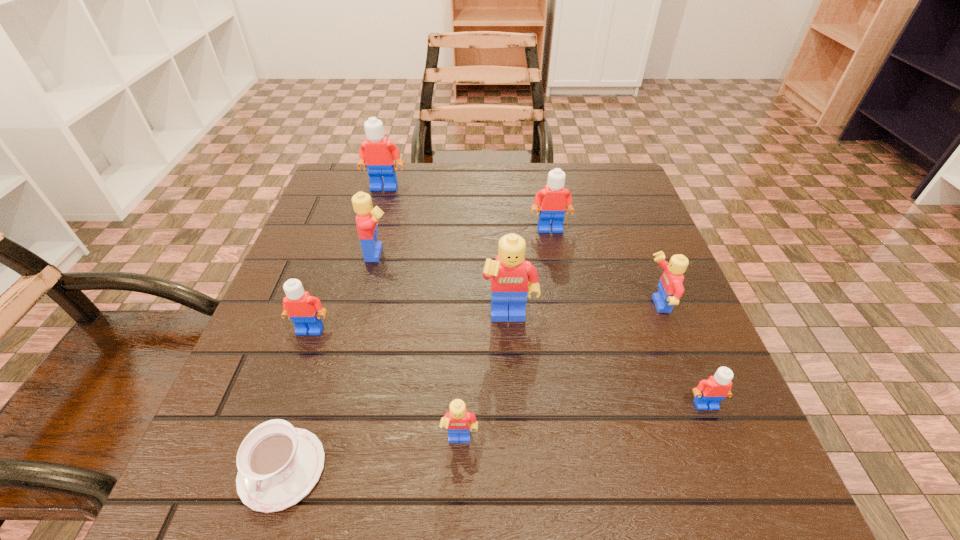
Identify the location of free space between the third yellow Lego from right to left and the third smallest yellow Lego. This screenshot has width=960, height=540. (420, 347).

I want to click on free space between the farthest white Lego and the nearest Lego, so click(x=422, y=314).

The image size is (960, 540). In order to click on empty space between the teacup and the second smallest white Lego in this screenshot , I will do `click(297, 399)`.

Where is `vacant space in between the smallest white Lego and the second farthest object`? Image resolution: width=960 pixels, height=540 pixels. vacant space in between the smallest white Lego and the second farthest object is located at coordinates (628, 316).

The image size is (960, 540). I want to click on empty space between the seventh nearest object and the teacup, so click(331, 361).

Identify which object is the second closest to the nearest yellow Lego. Please provide its 2D coordinates. Your answer should be formatted as a tuple, i.e. [(x, y)], where the tuple contains the x and y coordinates of a point satisfying the conditions above.

[(509, 284)]

Find the location of a particular element. This screenshot has width=960, height=540. object that stands as the closest to the farthest Lego is located at coordinates (367, 218).

Where is `Lego that stands as the sixth closest to the third biggest white Lego`? The image size is (960, 540). Lego that stands as the sixth closest to the third biggest white Lego is located at coordinates (670, 285).

Identify which Lego is the fifth nearest to the fourth object from right to left. Please provide its 2D coordinates. Your answer should be formatted as a tuple, i.e. [(x, y)], where the tuple contains the x and y coordinates of a point satisfying the conditions above.

[(709, 393)]

Locate an element on the screen. The image size is (960, 540). yellow Lego that is the fourth closest to the farthest white Lego is located at coordinates (459, 422).